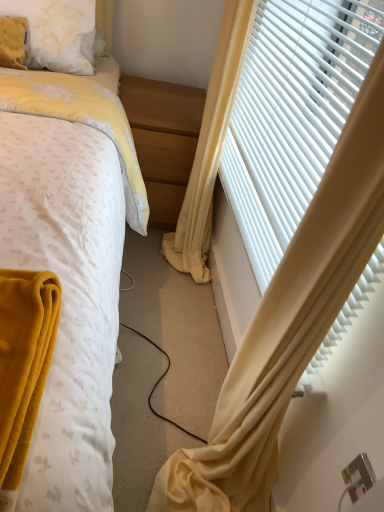
Question: From their relative heights in the image, would you say fluffy white pillow at upper left is taller or shorter than white plastic blinds at right?

Choices:
 (A) tall
 (B) short

Answer: (B)

Question: Considering the positions of fluffy white pillow at upper left and white plastic blinds at right in the image, is fluffy white pillow at upper left wider or thinner than white plastic blinds at right?

Choices:
 (A) thin
 (B) wide

Answer: (B)

Question: Which is nearer to the silver metallic electric outlet at lower right?

Choices:
 (A) light wood/finely finished nightstand at center
 (B) yellow fabric curtain at right, which is the second curtain from right to left
 (C) white plastic blinds at right
 (D) fluffy white pillow at upper left
 (E) yellow fabric curtain at right, the 2th curtain positioned from the left

Answer: (B)

Question: Considering the real-world distances, which object is farthest from the yellow fabric curtain at right, the 2th curtain positioned from the left?

Choices:
 (A) fluffy white pillow at upper left
 (B) yellow fabric curtain at right, the 1th curtain positioned from the left
 (C) silver metallic electric outlet at lower right
 (D) light wood/finely finished nightstand at center
 (E) white plastic blinds at right

Answer: (C)